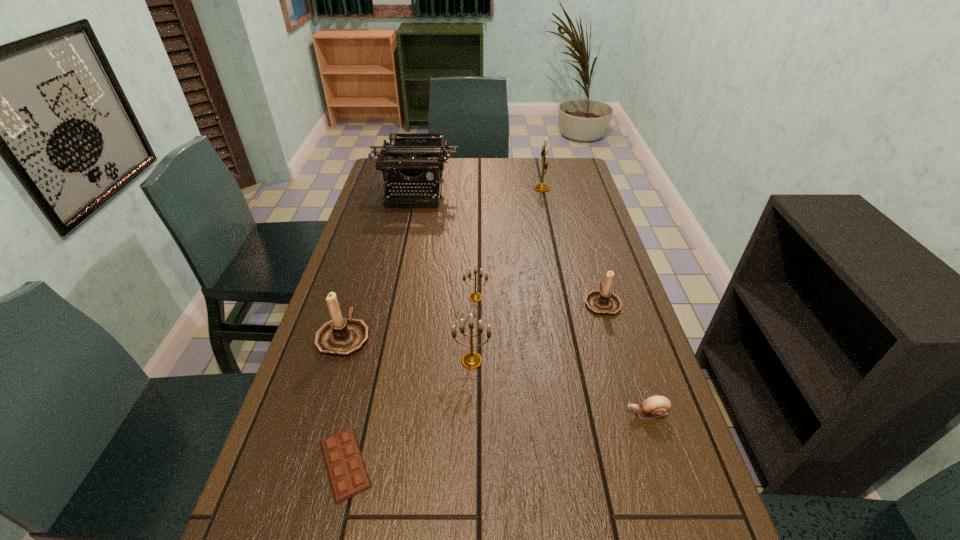
Identify the location of vacant area that lies between the rightmost gold candelabrum and the nearest object. [x=444, y=326].

I want to click on free space between the left brown candle holder and the rightmost candelabrum, so click(473, 319).

Where is `vacant area between the second nearest object and the rightmost candelabrum`? vacant area between the second nearest object and the rightmost candelabrum is located at coordinates (624, 357).

The image size is (960, 540). Identify the location of object that is the second closest one to the smallest gold candelabrum. (343, 337).

You are a GUI agent. You are given a task and a screenshot of the screen. Output one action in this format:
    pyautogui.click(x=<x>, y=<y>)
    Task: Click on the closest object to the second biggest gold candelabrum
    
    Given the screenshot: What is the action you would take?
    pyautogui.click(x=475, y=296)

Locate an element on the screen. The image size is (960, 540). the fifth closest candelabrum to the shortest object is located at coordinates point(540,187).

Where is `candelabrum that stands as the second closest to the typewriter`? This screenshot has width=960, height=540. candelabrum that stands as the second closest to the typewriter is located at coordinates (475, 296).

This screenshot has width=960, height=540. Identify the location of the closest gold candelabrum relative to the leftmost candelabrum. (471, 360).

Find the location of a particular element. The height and width of the screenshot is (540, 960). gold candelabrum that is the second closest one to the second nearest gold candelabrum is located at coordinates (540, 187).

Identify the location of vacant space that satisfies the following two spatial constraints: 1. on the keyboard of the typewriter; 2. on the left side of the second nearest gold candelabrum. The width and height of the screenshot is (960, 540). (392, 297).